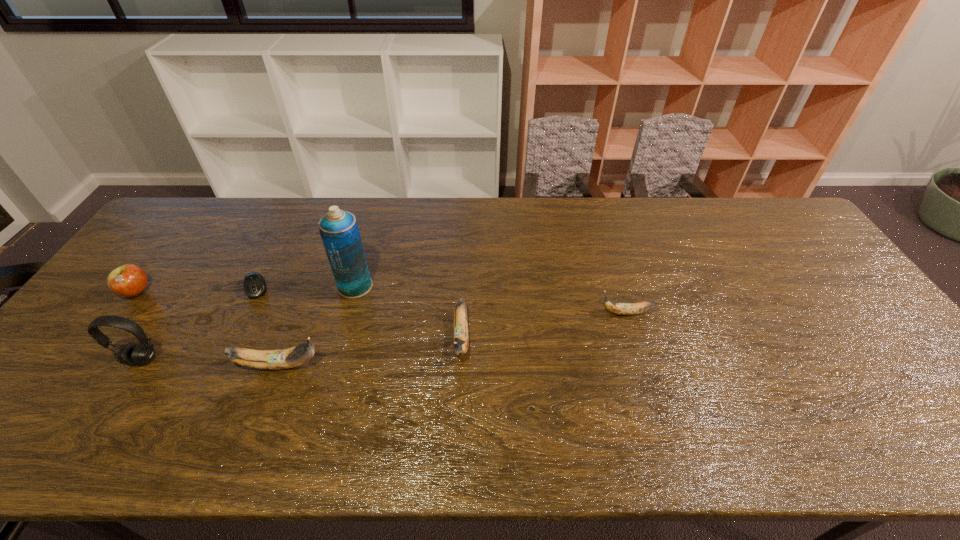
Where is `vacant place for an extra banana on the right`? This screenshot has height=540, width=960. vacant place for an extra banana on the right is located at coordinates (776, 291).